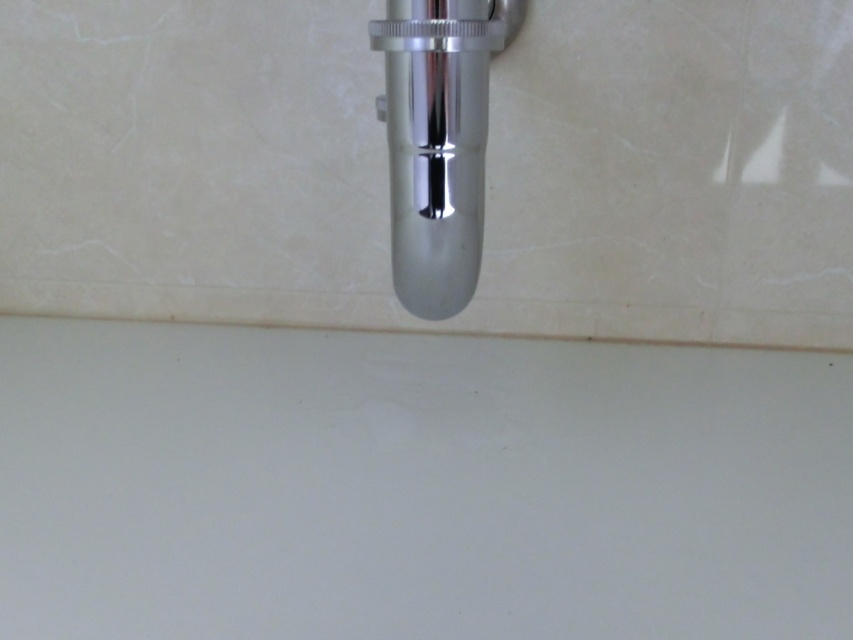
Question: Does white matte sink at bottom lie behind polished chrome faucet at center?

Choices:
 (A) no
 (B) yes

Answer: (A)

Question: Can you confirm if white matte sink at bottom is positioned to the right of polished chrome faucet at center?

Choices:
 (A) no
 (B) yes

Answer: (A)

Question: Which point is closer to the camera?

Choices:
 (A) polished chrome faucet at center
 (B) white matte sink at bottom

Answer: (B)

Question: Is white matte sink at bottom to the left of polished chrome faucet at center from the viewer's perspective?

Choices:
 (A) yes
 (B) no

Answer: (A)

Question: Which object is farther from the camera taking this photo?

Choices:
 (A) white matte sink at bottom
 (B) polished chrome faucet at center

Answer: (B)